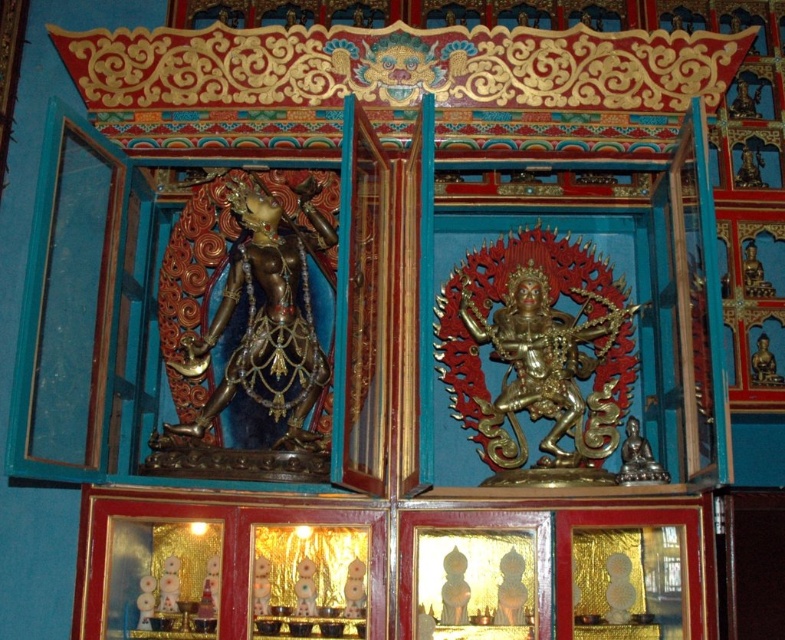
Is gold metallic statue at center taller than gold-bronze statue at left?

In fact, gold metallic statue at center may be shorter than gold-bronze statue at left.

Is gold metallic statue at center positioned at the back of gold-bronze statue at left?

That is True.

Which is in front, point (508, 403) or point (280, 216)?

Point (508, 403) is in front.

Identify the location of gold metallic statue at center. (537, 349).